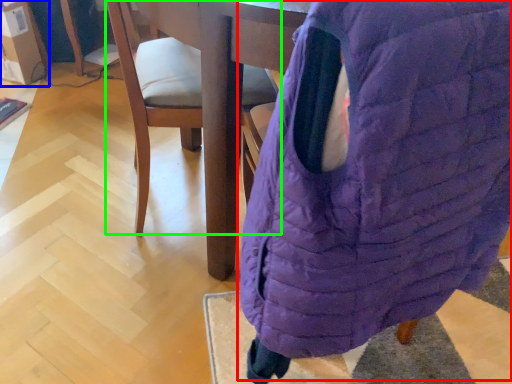
Question: Which is farther away from bean bag chair (highlighted by a red box)? cardboard box (highlighted by a blue box) or chair (highlighted by a green box)?

Choices:
 (A) cardboard box
 (B) chair

Answer: (A)